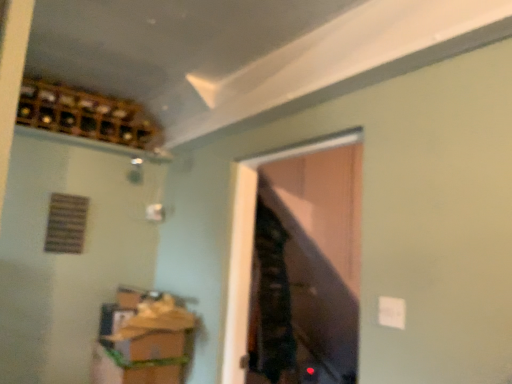
Measure the distance between wooden wine rack at upper left and camera.

7.22 feet.

This screenshot has height=384, width=512. Find the location of `transparent glass door at center`. transparent glass door at center is located at coordinates (297, 263).

Identify the location of wooden cabinet at lower left. The width and height of the screenshot is (512, 384). (142, 340).

Looking at this image, how far apart are wooden cabinet at lower left and transparent glass door at center?

A distance of 29.74 inches exists between wooden cabinet at lower left and transparent glass door at center.

Who is more distant, wooden cabinet at lower left or transparent glass door at center?

wooden cabinet at lower left.

Is wooden cabinet at lower left aimed at transparent glass door at center?

Yes, wooden cabinet at lower left is oriented towards transparent glass door at center.

Considering the sizes of wooden cabinet at lower left and transparent glass door at center in the image, is wooden cabinet at lower left wider or thinner than transparent glass door at center?

Clearly, wooden cabinet at lower left has more width compared to transparent glass door at center.

Is wooden wine rack at upper left spatially inside wooden cabinet at lower left, or outside of it?

wooden wine rack at upper left is located beyond the bounds of wooden cabinet at lower left.

Which object is thinner, wooden wine rack at upper left or wooden cabinet at lower left?

wooden wine rack at upper left is thinner.

From the picture: From a real-world perspective, is wooden wine rack at upper left located higher than wooden cabinet at lower left?

Yes.

Considering the relative sizes of transparent glass door at center and wooden wine rack at upper left in the image provided, is transparent glass door at center thinner than wooden wine rack at upper left?

Indeed, transparent glass door at center has a lesser width compared to wooden wine rack at upper left.

Considering the positions of objects transparent glass door at center and wooden wine rack at upper left in the image provided, who is in front, transparent glass door at center or wooden wine rack at upper left?

transparent glass door at center is in front.

Would you say transparent glass door at center is inside or outside wooden wine rack at upper left?

transparent glass door at center is not inside wooden wine rack at upper left, it's outside.

Which of these two, transparent glass door at center or wooden wine rack at upper left, stands shorter?

wooden wine rack at upper left.

Choose the correct answer: Is wooden wine rack at upper left inside transparent glass door at center or outside it?

The correct answer is: outside.

From a real-world perspective, who is located lower, wooden wine rack at upper left or transparent glass door at center?

transparent glass door at center, from a real-world perspective.

Which is in front, wooden wine rack at upper left or transparent glass door at center?

transparent glass door at center is more forward.

Can you confirm if wooden wine rack at upper left is bigger than transparent glass door at center?

Indeed, wooden wine rack at upper left has a larger size compared to transparent glass door at center.

Identify the location of wine cabinet on the left of wooden cabinet at lower left. The height and width of the screenshot is (384, 512). (86, 115).

Who is shorter, wooden cabinet at lower left or wooden wine rack at upper left?

With less height is wooden wine rack at upper left.

Can you tell me how much wooden cabinet at lower left and wooden wine rack at upper left differ in facing direction?

The facing directions of wooden cabinet at lower left and wooden wine rack at upper left are 0.275 degrees apart.

Looking at this image, considering the relative positions of wooden cabinet at lower left and wooden wine rack at upper left in the image provided, is wooden cabinet at lower left to the left or to the right of wooden wine rack at upper left?

Clearly, wooden cabinet at lower left is on the right of wooden wine rack at upper left in the image.

In the scene shown: From a real-world perspective, is transparent glass door at center over wooden cabinet at lower left?

Correct, in the physical world, transparent glass door at center is higher than wooden cabinet at lower left.

Are transparent glass door at center and wooden cabinet at lower left located far from each other?

No, transparent glass door at center is in close proximity to wooden cabinet at lower left.

Is transparent glass door at center wider than wooden cabinet at lower left?

No.

From the picture: Is transparent glass door at center facing towards wooden cabinet at lower left?

No, transparent glass door at center is not oriented towards wooden cabinet at lower left.

Where is `cabinetry behind the transparent glass door at center`? This screenshot has width=512, height=384. cabinetry behind the transparent glass door at center is located at coordinates (142, 340).

Find the location of `wine cabinet that is above the wooden cabinet at lower left (from the image's perspective)`. wine cabinet that is above the wooden cabinet at lower left (from the image's perspective) is located at coordinates (86, 115).

Estimate the real-world distances between objects in this image. Which object is closer to wooden cabinet at lower left, wooden wine rack at upper left or transparent glass door at center?

transparent glass door at center is positioned closer to the anchor wooden cabinet at lower left.

Based on their spatial positions, is wooden cabinet at lower left or transparent glass door at center further from wooden wine rack at upper left?

transparent glass door at center lies further to wooden wine rack at upper left than the other object.

When comparing their distances from wooden cabinet at lower left, does transparent glass door at center or wooden wine rack at upper left seem further?

wooden wine rack at upper left is positioned further to the anchor wooden cabinet at lower left.

Considering their positions, is transparent glass door at center positioned closer to wooden wine rack at upper left than wooden cabinet at lower left?

wooden cabinet at lower left lies closer to wooden wine rack at upper left than the other object.

When comparing their distances from transparent glass door at center, does wooden cabinet at lower left or wooden wine rack at upper left seem closer?

wooden cabinet at lower left.

From the image, which object appears to be nearer to transparent glass door at center, wooden wine rack at upper left or wooden cabinet at lower left?

wooden cabinet at lower left is positioned closer to the anchor transparent glass door at center.

Image resolution: width=512 pixels, height=384 pixels. In order to click on window that lies between wooden wine rack at upper left and wooden cabinet at lower left from top to bottom in this screenshot , I will do (297, 263).